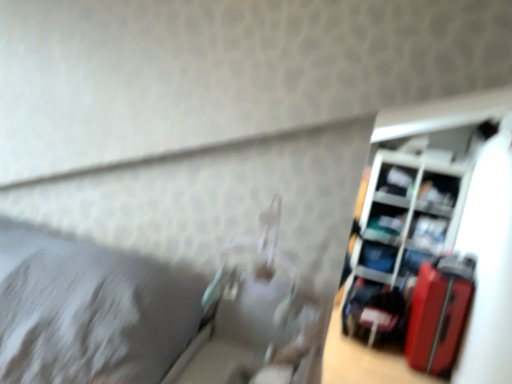
Where is `free spot above matte black laptop at right, which is the 1th shelf in bottom-to-top order (from a real-world perspective)`? This screenshot has height=384, width=512. free spot above matte black laptop at right, which is the 1th shelf in bottom-to-top order (from a real-world perspective) is located at coordinates (382, 236).